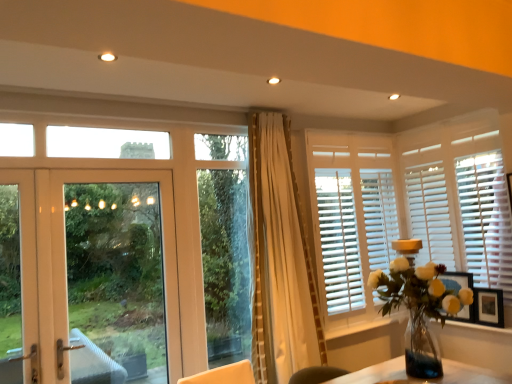
Question: Is white wood window sill at lower right smaller than white wood blinds at right?

Choices:
 (A) no
 (B) yes

Answer: (B)

Question: Is white wood window sill at lower right shorter than white wood blinds at right?

Choices:
 (A) yes
 (B) no

Answer: (A)

Question: Considering the relative positions of white wood window sill at lower right and white wood blinds at right in the image provided, is white wood window sill at lower right to the left of white wood blinds at right from the viewer's perspective?

Choices:
 (A) no
 (B) yes

Answer: (B)

Question: Is white wood window sill at lower right located outside white wood blinds at right?

Choices:
 (A) no
 (B) yes

Answer: (B)

Question: From the image's perspective, is white wood window sill at lower right beneath white wood blinds at right?

Choices:
 (A) no
 (B) yes

Answer: (B)

Question: From a real-world perspective, is white wood window sill at lower right positioned over white wood blinds at right based on gravity?

Choices:
 (A) yes
 (B) no

Answer: (B)

Question: Is translucent glass vase at right in contact with white wood window sill at lower right?

Choices:
 (A) yes
 (B) no

Answer: (B)

Question: Can you confirm if translucent glass vase at right is bigger than white wood window sill at lower right?

Choices:
 (A) no
 (B) yes

Answer: (B)

Question: From the image's perspective, is translucent glass vase at right on top of white wood window sill at lower right?

Choices:
 (A) no
 (B) yes

Answer: (B)

Question: Is translucent glass vase at right further to the viewer compared to white wood window sill at lower right?

Choices:
 (A) no
 (B) yes

Answer: (A)

Question: From the image's perspective, is translucent glass vase at right under white wood window sill at lower right?

Choices:
 (A) no
 (B) yes

Answer: (A)

Question: Would you say translucent glass vase at right is a long distance from white wood window sill at lower right?

Choices:
 (A) no
 (B) yes

Answer: (A)

Question: Can you confirm if translucent glass vase at right is positioned to the left of wooden picture frame at right?

Choices:
 (A) no
 (B) yes

Answer: (B)